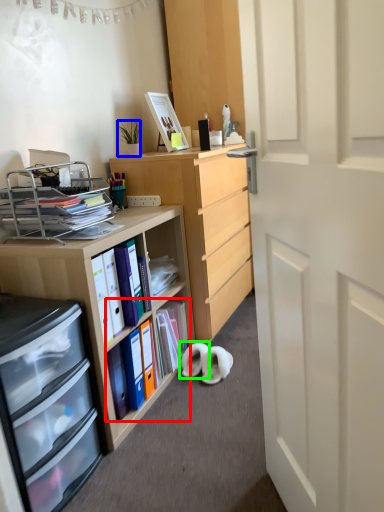
Question: Considering the real-world distances, which object is farthest from book (highlighted by a red box)? houseplant (highlighted by a blue box) or footwear (highlighted by a green box)?

Choices:
 (A) houseplant
 (B) footwear

Answer: (A)